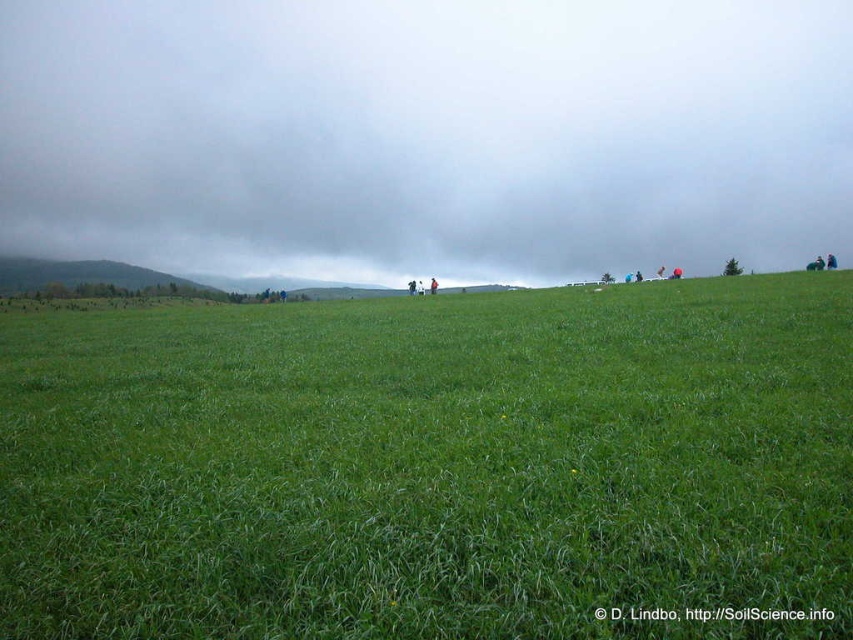
Consider the image. You are planning to take a photo of the green grassy field at center and the gray cloudy sky at upper center. Which one of these two elements will occupy more space in your photo?

The gray cloudy sky at upper center occupies more space in the photo because the green grassy field at center has a smaller size compared to the gray cloudy sky at upper center according to the description.

You are standing in the middle of the grassland and want to reach the point marked as point (645, 570). If you walk straight towards it, how far will you have to walk?

The distance between you and point (645, 570) is 4.58 meters, so you will have to walk 4.58 meters to reach it.